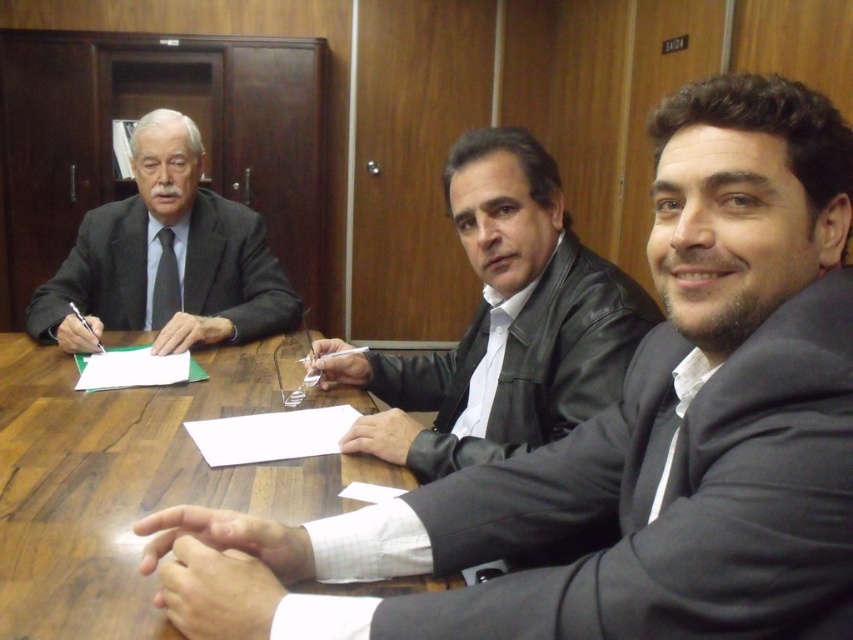
Does leather jacket at center appear under matte black suit at left?

Correct, leather jacket at center is located below matte black suit at left.

Who is positioned more to the left, leather jacket at center or matte black suit at left?

From the viewer's perspective, matte black suit at left appears more on the left side.

Does point (498, 340) come closer to viewer compared to point (112, 256)?

Yes, point (498, 340) is closer to viewer.

The height and width of the screenshot is (640, 853). In order to click on leather jacket at center in this screenshot , I will do `click(503, 324)`.

Is wooden table at center bigger than leather jacket at center?

Indeed, wooden table at center has a larger size compared to leather jacket at center.

Measure the distance from wooden table at center to leather jacket at center.

wooden table at center and leather jacket at center are 12.43 inches apart from each other.

The image size is (853, 640). What are the coordinates of `wooden table at center` in the screenshot? It's located at (129, 484).

Which of these two, wooden table at center or matte black suit at left, stands taller?

matte black suit at left

Is wooden table at center wider than matte black suit at left?

Yes, wooden table at center is wider than matte black suit at left.

Find the location of a particular element. wooden table at center is located at coordinates (129, 484).